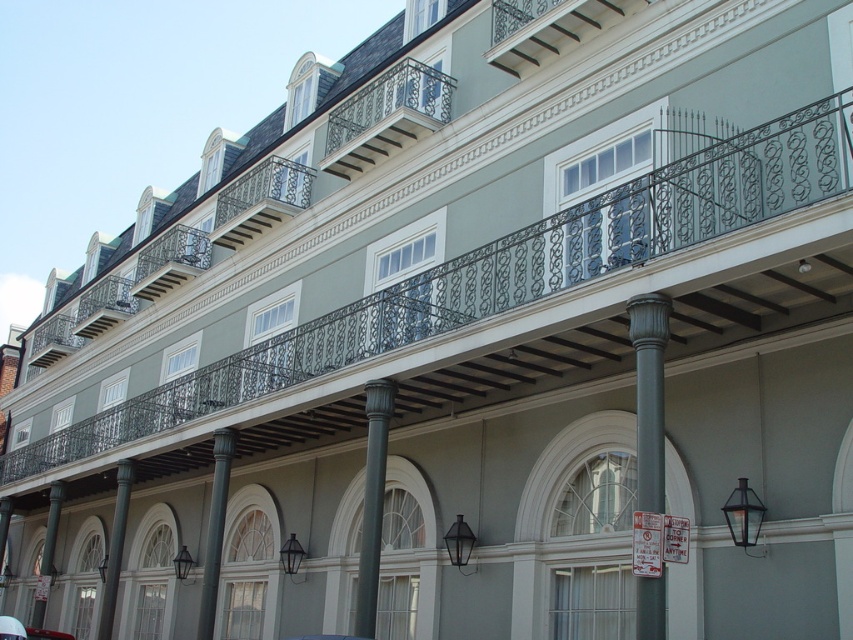
You are standing at the entrance of the building and want to locate the black wrought iron balcony at upper center. According to the coordinates provided, where should you look relative to the building?

The black wrought iron balcony at upper center is located at coordinates point (386, 116), so you should look towards the upper center area of the building to find it.

You are standing in front of the building and notice the black wrought iron balcony at upper center and the smooth gray column at lower left. Which object is positioned to the right side of the other?

The black wrought iron balcony at upper center is positioned to the right of the smooth gray column at lower left.

You are standing in front of the building and want to take a photo of both the black wrought iron balcony at upper center and the smooth gray column at lower left. Which object should you focus on first to ensure both are in sharp focus?

You should focus on the black wrought iron balcony at upper center first because it is closer to the viewer than the smooth gray column at lower left, so adjusting focus from near to far will help both be in focus.